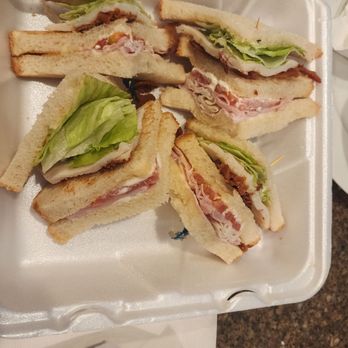
Identify the location of plate. The image size is (348, 348). (335, 155).